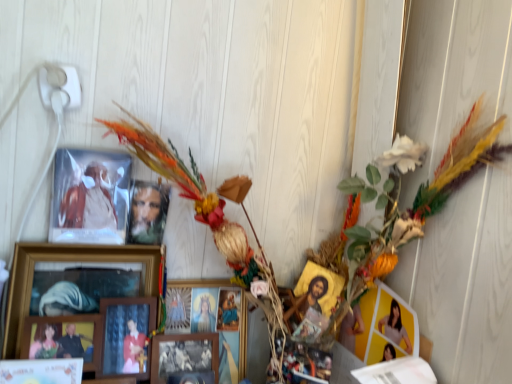
Question: Considering the relative positions of wooden picture frame at lower left, the 7th picture frame when ordered from right to left, and wooden photo frame at center, marked as the sixth picture frame in a left-to-right arrangement, in the image provided, is wooden picture frame at lower left, the 7th picture frame when ordered from right to left, to the right of wooden photo frame at center, marked as the sixth picture frame in a left-to-right arrangement, from the viewer's perspective?

Choices:
 (A) yes
 (B) no

Answer: (B)

Question: Is wooden picture frame at lower left, which appears as the second picture frame when viewed from the left, further to the viewer compared to wooden photo frame at center, acting as the 3th picture frame starting from the right?

Choices:
 (A) yes
 (B) no

Answer: (B)

Question: Is wooden picture frame at lower left, which appears as the second picture frame when viewed from the left, bigger than wooden photo frame at center, acting as the 3th picture frame starting from the right?

Choices:
 (A) no
 (B) yes

Answer: (B)

Question: Is wooden picture frame at lower left, the 7th picture frame when ordered from right to left, turned away from wooden photo frame at center, acting as the 3th picture frame starting from the right?

Choices:
 (A) no
 (B) yes

Answer: (A)

Question: Could you tell me if wooden picture frame at lower left, the 7th picture frame when ordered from right to left, is turned towards wooden photo frame at center, marked as the sixth picture frame in a left-to-right arrangement?

Choices:
 (A) no
 (B) yes

Answer: (A)

Question: Based on their sizes in the image, would you say matte wooden portrait at upper left, marked as the 4th picture frame in a right-to-left arrangement, is bigger or smaller than wooden framed picture at center, the 7th picture frame when ordered from left to right?

Choices:
 (A) small
 (B) big

Answer: (A)

Question: In the image, is matte wooden portrait at upper left, arranged as the fifth picture frame when viewed from the left, positioned in front of or behind wooden framed picture at center, the second picture frame positioned from the right?

Choices:
 (A) front
 (B) behind

Answer: (B)

Question: Would you say matte wooden portrait at upper left, arranged as the fifth picture frame when viewed from the left, is inside or outside wooden framed picture at center, the second picture frame positioned from the right?

Choices:
 (A) inside
 (B) outside

Answer: (B)

Question: Based on their positions, is matte wooden portrait at upper left, arranged as the fifth picture frame when viewed from the left, located to the left or right of wooden framed picture at center, the second picture frame positioned from the right?

Choices:
 (A) left
 (B) right

Answer: (A)

Question: In terms of height, does wooden framed picture at center, the second picture frame positioned from the right, look taller or shorter compared to multicolored feathered wreath at upper left?

Choices:
 (A) short
 (B) tall

Answer: (A)

Question: From a real-world perspective, is wooden framed picture at center, the 7th picture frame when ordered from left to right, positioned above or below multicolored feathered wreath at upper left?

Choices:
 (A) below
 (B) above

Answer: (A)

Question: Is wooden framed picture at center, the 7th picture frame when ordered from left to right, wider or thinner than multicolored feathered wreath at upper left?

Choices:
 (A) wide
 (B) thin

Answer: (B)

Question: Considering their positions, is wooden framed picture at center, the second picture frame positioned from the right, located in front of or behind multicolored feathered wreath at upper left?

Choices:
 (A) behind
 (B) front

Answer: (A)

Question: From the image's perspective, is gold textured icon at center-right, which is the first picture frame from right to left, located above or below white glossy picture frame at lower left, the eighth picture frame in the right-to-left sequence?

Choices:
 (A) below
 (B) above

Answer: (B)

Question: Considering the positions of gold textured icon at center-right, which is the 8th picture frame in left-to-right order, and white glossy picture frame at lower left, the eighth picture frame in the right-to-left sequence, in the image, is gold textured icon at center-right, which is the 8th picture frame in left-to-right order, taller or shorter than white glossy picture frame at lower left, the eighth picture frame in the right-to-left sequence,?

Choices:
 (A) tall
 (B) short

Answer: (B)